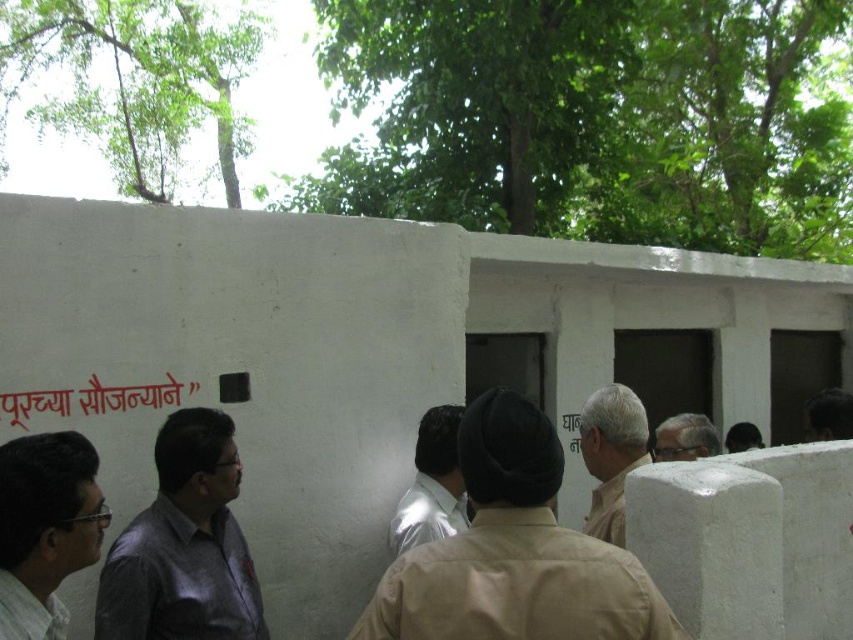
You are a photographer trying to capture a group photo of the shiny white shirt at center and the dark brown hair at upper right. Based on their heights, which person should stand in the front row to ensure both are visible?

The shiny white shirt at center is taller than the dark brown hair at upper right, so the dark brown hair at upper right should stand in the front row to ensure both are visible.

You are a photographer trying to capture a photo of the dark gray shirt at center without including the beige fabric hat at center in the frame. Based on their positions, is this possible?

The beige fabric hat at center is in front of the dark gray shirt at center, so it would block the view. Therefore, it is not possible to capture the dark gray shirt at center without including the beige fabric hat at center in the frame.